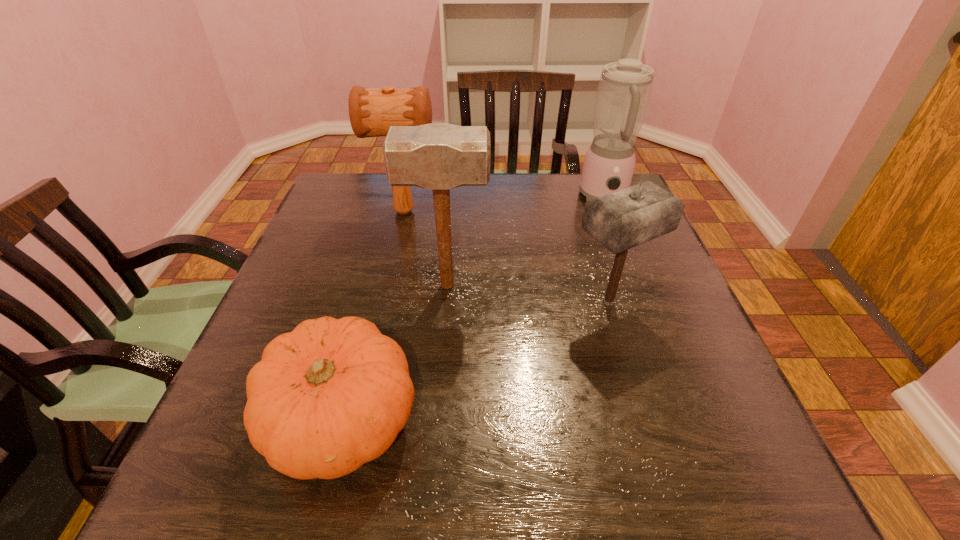
At what (x,y) coordinates should I click in order to perform the action: click on food processor. Please return your answer as a coordinate pair (x, y). Looking at the image, I should click on (624, 90).

You are a GUI agent. You are given a task and a screenshot of the screen. Output one action in this format:
    pyautogui.click(x=<x>, y=<y>)
    Task: Click on the farthest mallet
    
    Given the screenshot: What is the action you would take?
    pyautogui.click(x=372, y=111)

At what (x,y) coordinates should I click in order to perform the action: click on the rightmost mallet. Please return your answer as a coordinate pair (x, y). Looking at the image, I should click on (621, 220).

Where is `pumpkin`? The width and height of the screenshot is (960, 540). pumpkin is located at coordinates (333, 394).

You are a GUI agent. You are given a task and a screenshot of the screen. Output one action in this format:
    pyautogui.click(x=<x>, y=<y>)
    Task: Click on the nearest object
    The height and width of the screenshot is (540, 960).
    Given the screenshot: What is the action you would take?
    pyautogui.click(x=333, y=394)

Identify the location of vacant area located on the base of the food processor near the control knob. (615, 226).

Image resolution: width=960 pixels, height=540 pixels. I want to click on free spot located 0.090m on the strike surface of the farthest mallet, so click(x=472, y=212).

Identify the location of free location located 0.260m on the back of the rightmost mallet. The image size is (960, 540). (582, 213).

Identify the location of free space located 0.390m on the right of the pumpkin. This screenshot has width=960, height=540. (652, 420).

You are a GUI agent. You are given a task and a screenshot of the screen. Output one action in this format:
    pyautogui.click(x=<x>, y=<y>)
    Task: Click on the food processor that is at the far edge
    
    Given the screenshot: What is the action you would take?
    pyautogui.click(x=624, y=90)